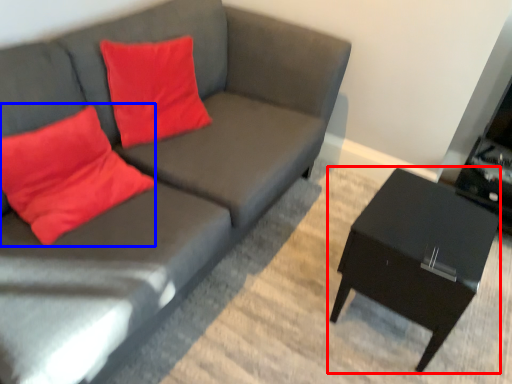
Question: Which point is closer to the camera, table (highlighted by a red box) or throw pillow (highlighted by a blue box)?

Choices:
 (A) table
 (B) throw pillow

Answer: (B)